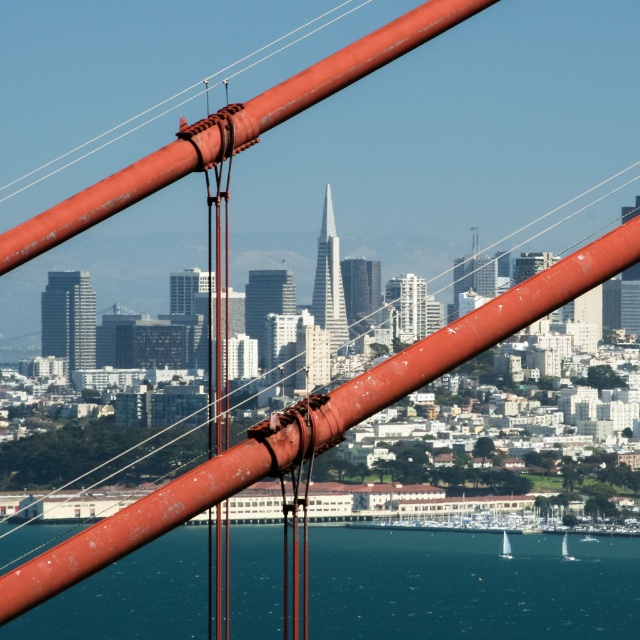
Question: Does white sailboat at lower center have a smaller size compared to white glossy sailboat at lower right?

Choices:
 (A) no
 (B) yes

Answer: (B)

Question: Is blue water at lower center positioned behind white sailboat at lower center?

Choices:
 (A) no
 (B) yes

Answer: (A)

Question: Which point appears farthest from the camera in this image?

Choices:
 (A) (563, 548)
 (B) (502, 531)

Answer: (A)

Question: Among these objects, which one is farthest from the camera?

Choices:
 (A) white sailboat at lower center
 (B) blue water at lower center

Answer: (A)

Question: Is blue water at lower center wider than white glossy sailboat at lower right?

Choices:
 (A) yes
 (B) no

Answer: (A)

Question: Which point is farther from the camera taking this photo?

Choices:
 (A) (141, 612)
 (B) (572, 560)

Answer: (B)